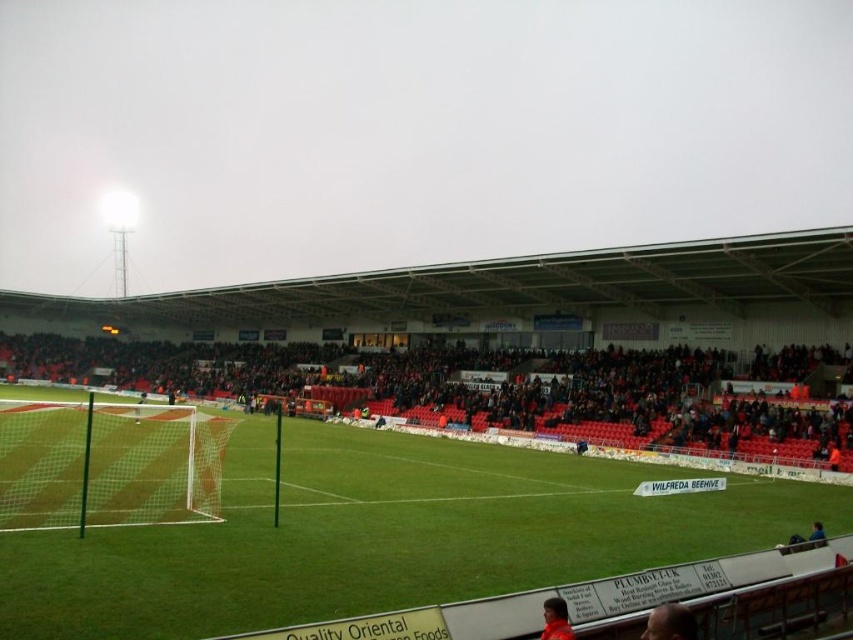
Who is higher up, matte green net at left or dark brown leather jacket at lower center?

matte green net at left is higher up.

Is point (782, 449) positioned behind point (573, 636)?

That is True.

Where is `matte green net at left`? This screenshot has height=640, width=853. matte green net at left is located at coordinates (486, 392).

Which is behind, point (672, 468) or point (561, 598)?

Positioned behind is point (672, 468).

Is point (201, 557) positioned in front of point (560, 609)?

That is False.

This screenshot has width=853, height=640. In order to click on green grass football field at center in this screenshot , I will do `click(383, 536)`.

Is green grass football field at center closer to the viewer compared to smooth brown hair at lower right?

No, it is behind smooth brown hair at lower right.

Between green grass football field at center and smooth brown hair at lower right, which one has less height?

With less height is smooth brown hair at lower right.

Who is more forward, (775, 509) or (659, 625)?

Point (659, 625)

Locate an element on the screen. green grass football field at center is located at coordinates (383, 536).